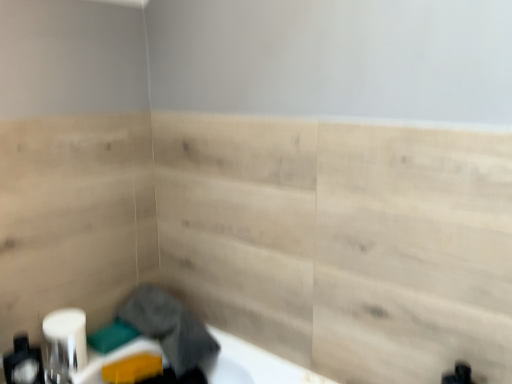
Question: Is gray fabric at lower left not close to natural wood paneling at center?

Choices:
 (A) yes
 (B) no

Answer: (B)

Question: Is gray fabric at lower left at the right side of natural wood paneling at center?

Choices:
 (A) yes
 (B) no

Answer: (B)

Question: Considering the relative sizes of gray fabric at lower left and natural wood paneling at center in the image provided, is gray fabric at lower left thinner than natural wood paneling at center?

Choices:
 (A) yes
 (B) no

Answer: (B)

Question: Considering the relative sizes of gray fabric at lower left and natural wood paneling at center in the image provided, is gray fabric at lower left shorter than natural wood paneling at center?

Choices:
 (A) no
 (B) yes

Answer: (B)

Question: Are gray fabric at lower left and natural wood paneling at center making contact?

Choices:
 (A) no
 (B) yes

Answer: (A)

Question: Does gray fabric at lower left lie in front of natural wood paneling at center?

Choices:
 (A) no
 (B) yes

Answer: (A)

Question: Is gray fabric at lower left thinner than matte white soap dispenser at lower left?

Choices:
 (A) no
 (B) yes

Answer: (A)

Question: Is gray fabric at lower left facing away from matte white soap dispenser at lower left?

Choices:
 (A) yes
 (B) no

Answer: (B)

Question: From the image's perspective, would you say gray fabric at lower left is shown under matte white soap dispenser at lower left?

Choices:
 (A) yes
 (B) no

Answer: (B)

Question: Is gray fabric at lower left shorter than matte white soap dispenser at lower left?

Choices:
 (A) yes
 (B) no

Answer: (A)

Question: Is gray fabric at lower left in contact with matte white soap dispenser at lower left?

Choices:
 (A) no
 (B) yes

Answer: (A)

Question: Is the position of gray fabric at lower left less distant than that of matte white soap dispenser at lower left?

Choices:
 (A) yes
 (B) no

Answer: (B)

Question: Is white glossy toilet paper at lower left oriented away from matte white soap dispenser at lower left?

Choices:
 (A) yes
 (B) no

Answer: (B)